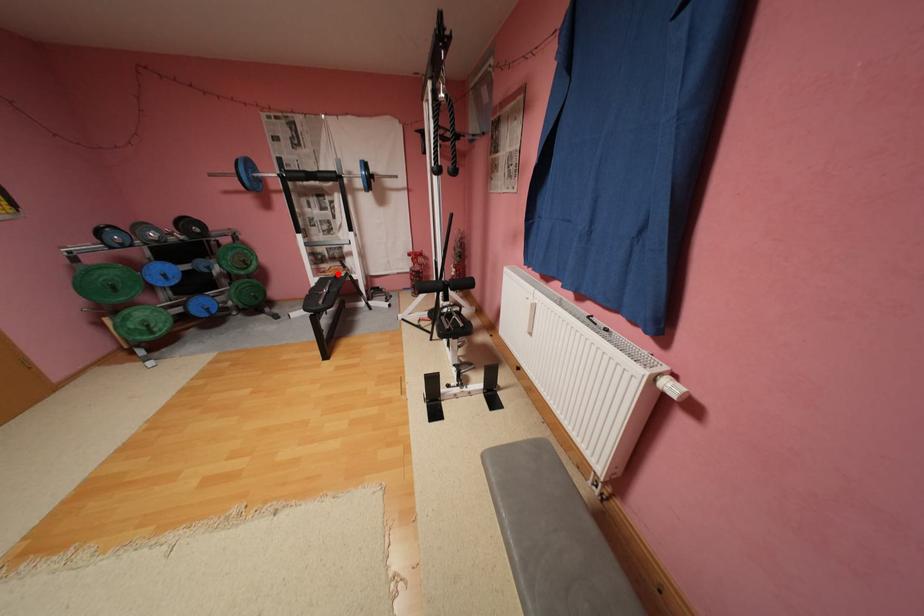
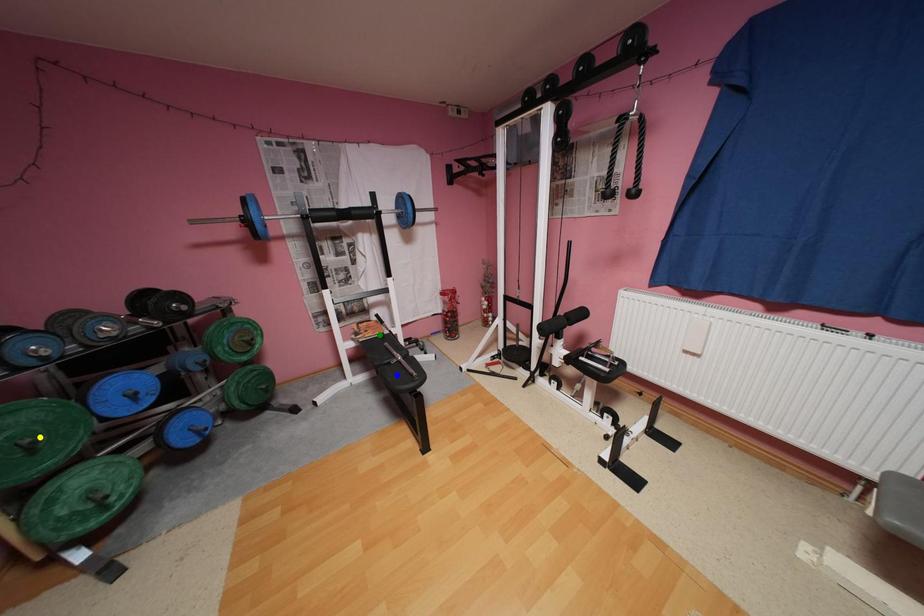
Question: I am providing you with two images of the same scene from different viewpoints. A red point is marked on the first image. You are given multiple points on the second image. Which mark in image 2 goes with the point in image 1?

Choices:
 (A) blue point
 (B) green point
 (C) yellow point

Answer: (B)